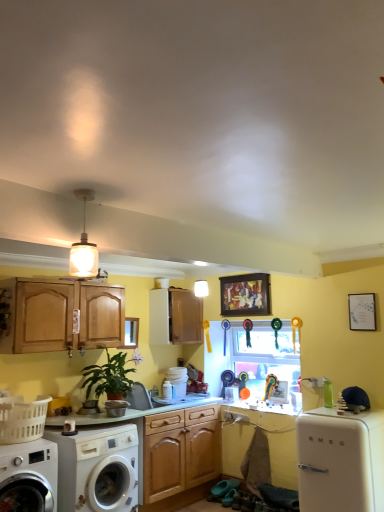
Question: Is the depth of matte wood cabinet at center greater than that of wooden framed artwork at upper center?

Choices:
 (A) yes
 (B) no

Answer: (A)

Question: From the image's perspective, is matte wood cabinet at center beneath wooden framed artwork at upper center?

Choices:
 (A) no
 (B) yes

Answer: (B)

Question: Could you tell me if matte wood cabinet at center is facing wooden framed artwork at upper center?

Choices:
 (A) no
 (B) yes

Answer: (B)

Question: Can you confirm if matte wood cabinet at center is taller than wooden framed artwork at upper center?

Choices:
 (A) no
 (B) yes

Answer: (B)

Question: Is matte wood cabinet at center shorter than wooden framed artwork at upper center?

Choices:
 (A) no
 (B) yes

Answer: (A)

Question: From a real-world perspective, is matte wood cabinet at center positioned under wooden framed artwork at upper center based on gravity?

Choices:
 (A) no
 (B) yes

Answer: (B)

Question: Is the surface of wooden framed artwork at upper center in direct contact with white glossy washing machine at lower left, positioned as the 2th washing machine in left-to-right order?

Choices:
 (A) yes
 (B) no

Answer: (B)

Question: Could you tell me if wooden framed artwork at upper center is turned towards white glossy washing machine at lower left, positioned as the 1th washing machine in right-to-left order?

Choices:
 (A) yes
 (B) no

Answer: (B)

Question: Considering the relative sizes of wooden framed artwork at upper center and white glossy washing machine at lower left, positioned as the 2th washing machine in left-to-right order, in the image provided, is wooden framed artwork at upper center bigger than white glossy washing machine at lower left, positioned as the 2th washing machine in left-to-right order,?

Choices:
 (A) no
 (B) yes

Answer: (A)

Question: From the image's perspective, is wooden framed artwork at upper center located beneath white glossy washing machine at lower left, positioned as the 2th washing machine in left-to-right order?

Choices:
 (A) no
 (B) yes

Answer: (A)

Question: From a real-world perspective, is wooden framed artwork at upper center physically below white glossy washing machine at lower left, positioned as the 2th washing machine in left-to-right order?

Choices:
 (A) no
 (B) yes

Answer: (A)

Question: Is wooden framed artwork at upper center taller than white glossy washing machine at lower left, positioned as the 1th washing machine in right-to-left order?

Choices:
 (A) yes
 (B) no

Answer: (B)

Question: Is white glass pendant light at upper center positioned behind green matte plant at lower left?

Choices:
 (A) no
 (B) yes

Answer: (A)